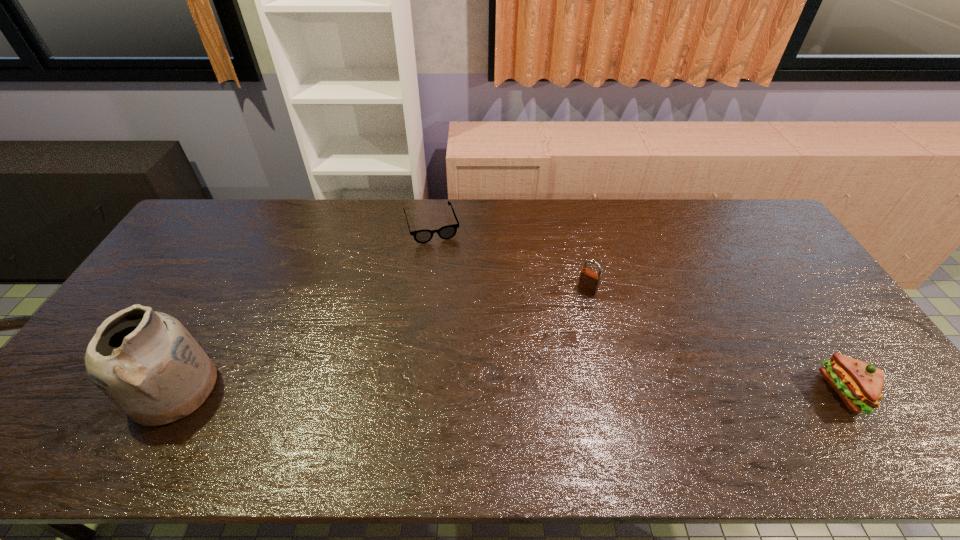
Identify the location of vacant region between the farthest object and the second farthest object. The width and height of the screenshot is (960, 540). (510, 258).

The image size is (960, 540). I want to click on unoccupied position between the second object from right to left and the tallest object, so click(x=381, y=339).

Where is `free point between the spectacles and the rightmost object`? The image size is (960, 540). free point between the spectacles and the rightmost object is located at coordinates (639, 309).

The width and height of the screenshot is (960, 540). Identify the location of blank region between the third nearest object and the farthest object. (510, 258).

Where is `vacant space that is in between the third nearest object and the sandwich`? The width and height of the screenshot is (960, 540). vacant space that is in between the third nearest object and the sandwich is located at coordinates (717, 341).

The width and height of the screenshot is (960, 540). What are the coordinates of `free space between the second object from right to left and the sandwich` in the screenshot? It's located at (717, 341).

Locate an element on the screen. vacant point located between the third object from left to right and the pottery is located at coordinates (381, 339).

Select which object appears as the closest to the tallest object. Please provide its 2D coordinates. Your answer should be formatted as a tuple, i.e. [(x, y)], where the tuple contains the x and y coordinates of a point satisfying the conditions above.

[(446, 232)]

At what (x,y) coordinates should I click in order to perform the action: click on the closest object to the padlock. Please return your answer as a coordinate pair (x, y). This screenshot has height=540, width=960. Looking at the image, I should click on (446, 232).

The image size is (960, 540). I want to click on vacant space that satisfies the following two spatial constraints: 1. on the front side of the farthest object; 2. on the right side of the padlock, so click(423, 289).